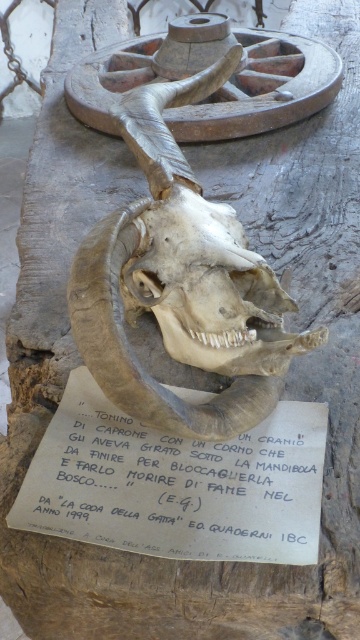
From the picture: You are a museum curator setting up an exhibit. You have two items to place on a display shelf that is 5 inches wide. The items are the brown leather skull at center and the brown textured skull at center. Can both items fit side by side on the shelf without overlapping?

The distance between the brown leather skull at center and the brown textured skull at center is 5.25 inches. Since the shelf is only 5 inches wide, the two items cannot fit side by side without overlapping.

You are an archaeologist examining the wooden surface. You notice the brown leather skull at center and the white paper at center. Which object is closer to you?

The brown leather skull at center is closer to you since the white paper at center is behind it.